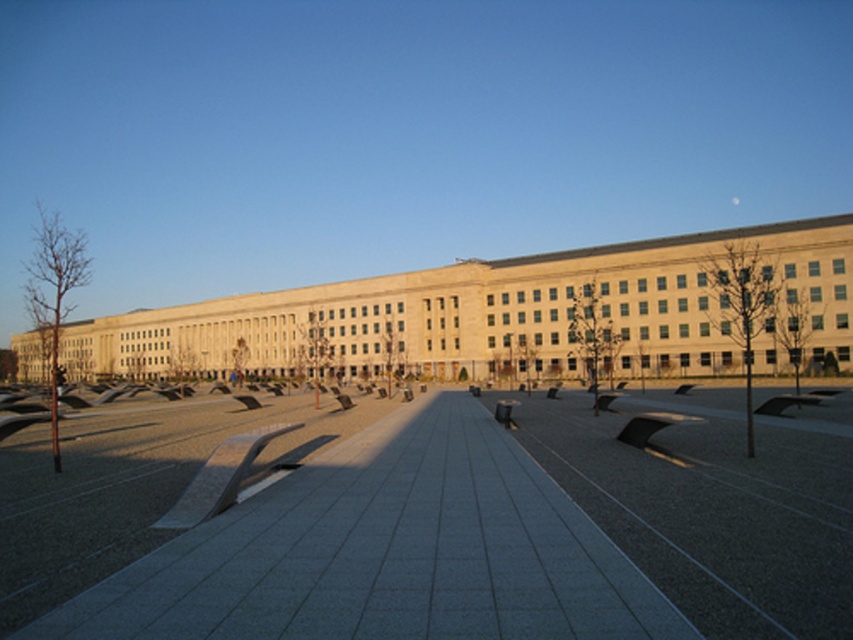
You are planning to host an outdoor event in the plaza area. Given the presence of the smooth concrete skate park at center and the beige stone plaza at center, which surface would be more suitable for setting up temporary tents and equipment?

The beige stone plaza at center is more suitable for setting up temporary tents and equipment because the smooth concrete skate park at center is located above it, making the plaza a flatter and more stable surface.